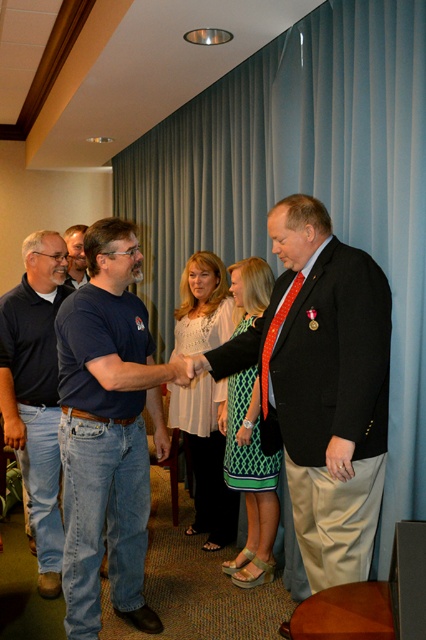
Question: Is denim jeans at center below white lace blouse at center?

Choices:
 (A) no
 (B) yes

Answer: (B)

Question: Which point is farther to the camera?

Choices:
 (A) (31, 496)
 (B) (204, 268)

Answer: (B)

Question: Among these objects, which one is nearest to the camera?

Choices:
 (A) green textured dress at center
 (B) matte black suit at center

Answer: (B)

Question: Is denim jeans at left to the left of green textured dress at center from the viewer's perspective?

Choices:
 (A) no
 (B) yes

Answer: (B)

Question: Can you confirm if blue fabric curtain at center is smaller than denim jeans at center?

Choices:
 (A) yes
 (B) no

Answer: (B)

Question: Which of the following is the closest to the observer?

Choices:
 (A) (402, 344)
 (B) (71, 268)
 (C) (313, 451)
 (D) (46, 580)

Answer: (C)